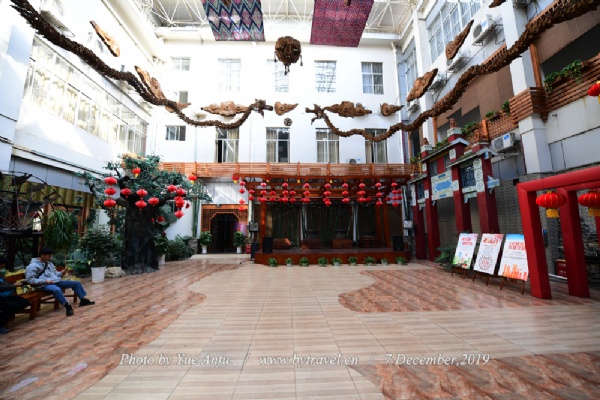
Image resolution: width=600 pixels, height=400 pixels. Identify the location of floor. (271, 322).